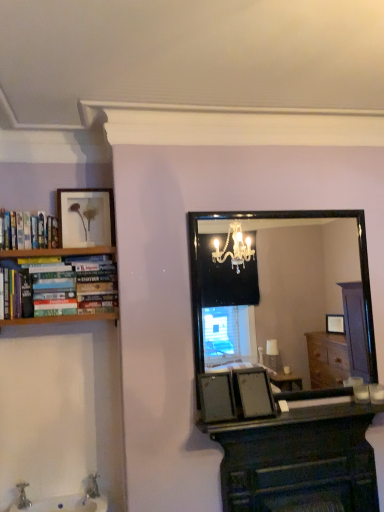
Where is `empty space that is ontop of dark wood computer desk at center`? empty space that is ontop of dark wood computer desk at center is located at coordinates (308, 417).